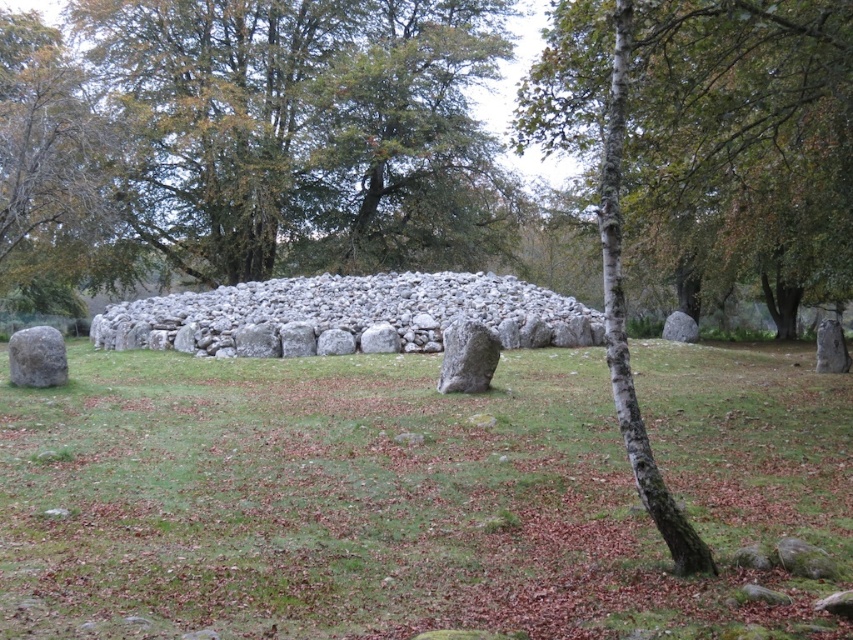
You are standing at the center of the ancient stone structure and want to place a small offering on the green grass at center. According to the coordinates provided, where should you place it?

The green grass at center should be placed at the coordinates point [410,496].

You are a hiker who wants to place a small marker at the base of the green grass at center. However, you need to ensure that the marker won not be obscured by the bark textured tree at center. Based on the scene, will the tree block the view of the marker from a distance?

The green grass at center is shorter than the bark textured tree at center. Since the tree is taller, it could potentially block the view of the marker placed at the grass from a distance depending on the viewing angle and distance.

You are standing in front of an ancient stone cairn. You see a gray rough boulder at center and a gray smooth boulder at left. Which boulder is nearer to you?

The gray rough boulder at center is closer to the viewer than the gray smooth boulder at left, so the gray rough boulder at center is nearer to you.